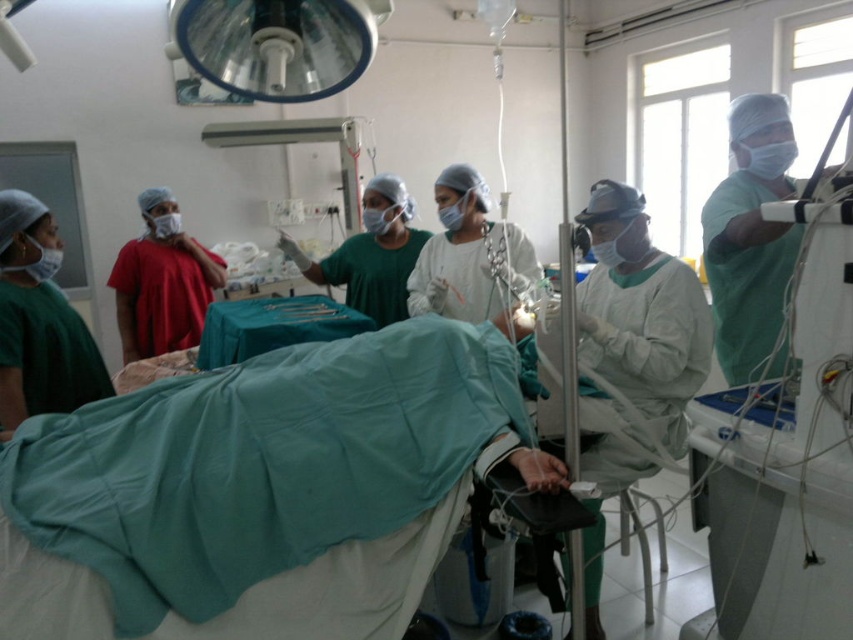
Is green matte scrubs at right shorter than metallic surgical instruments at center?

No.

Is green matte scrubs at right below metallic surgical instruments at center?

No.

Who is more distant from viewer, (776, 358) or (250, 314)?

The point (250, 314) is more distant.

Locate an element on the screen. green matte scrubs at right is located at coordinates (751, 240).

Who is more forward, (578, 369) or (704, 232)?

Positioned in front is point (578, 369).

Is green matte surgical gown at center taller than green matte scrubs at right?

Correct, green matte surgical gown at center is much taller as green matte scrubs at right.

Image resolution: width=853 pixels, height=640 pixels. In order to click on green matte surgical gown at center in this screenshot , I will do `click(631, 358)`.

Who is more distant from viewer, (686, 276) or (253, 346)?

Point (253, 346)

Between green matte surgical gown at center and metallic surgical instruments at center, which one is positioned lower?

green matte surgical gown at center

Describe the element at coordinates (631, 358) in the screenshot. I see `green matte surgical gown at center` at that location.

Where is `green matte surgical gown at center`? green matte surgical gown at center is located at coordinates (631, 358).